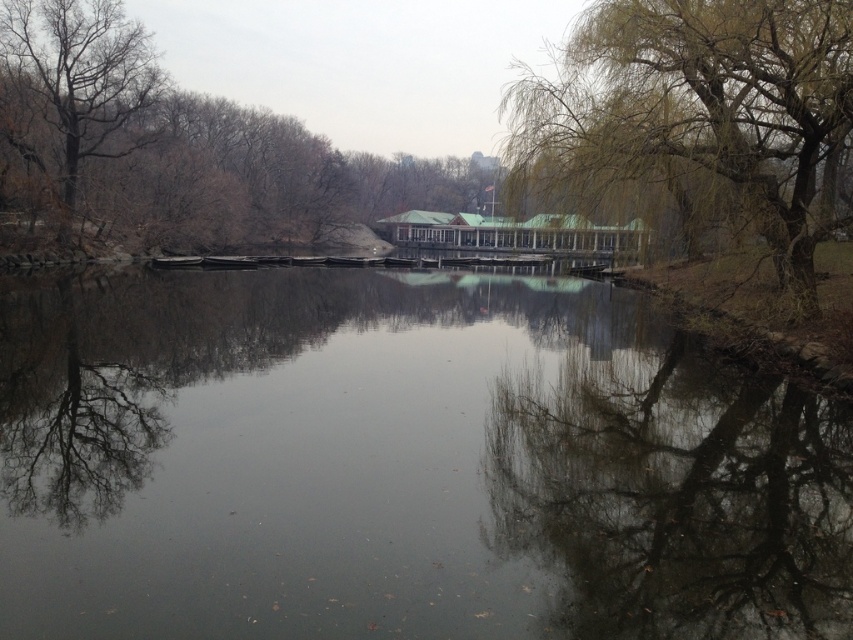
Is green textured tree at right below bare wood tree at upper left?

No, green textured tree at right is not below bare wood tree at upper left.

Which is more to the left, green textured tree at right or bare wood tree at upper left?

bare wood tree at upper left is more to the left.

Who is more distant from viewer, (653, 29) or (57, 12)?

Positioned behind is point (57, 12).

Find the location of a particular element. green textured tree at right is located at coordinates (699, 113).

Looking at this image, is bare branches at upper left to the left of bare wood tree at upper left from the viewer's perspective?

In fact, bare branches at upper left is to the right of bare wood tree at upper left.

Which is behind, point (120, 38) or point (45, 108)?

Positioned behind is point (120, 38).

Who is more distant from viewer, (328, 141) or (137, 88)?

The point (328, 141) is more distant.

Locate an element on the screen. bare branches at upper left is located at coordinates (175, 145).

Is smooth reflective water at center positioned behind bare wood tree at upper left?

No, smooth reflective water at center is in front of bare wood tree at upper left.

You are a GUI agent. You are given a task and a screenshot of the screen. Output one action in this format:
    pyautogui.click(x=<x>, y=<y>)
    Task: Click on the smooth reflective water at center
    Image resolution: width=853 pixels, height=640 pixels.
    Given the screenshot: What is the action you would take?
    (x=402, y=465)